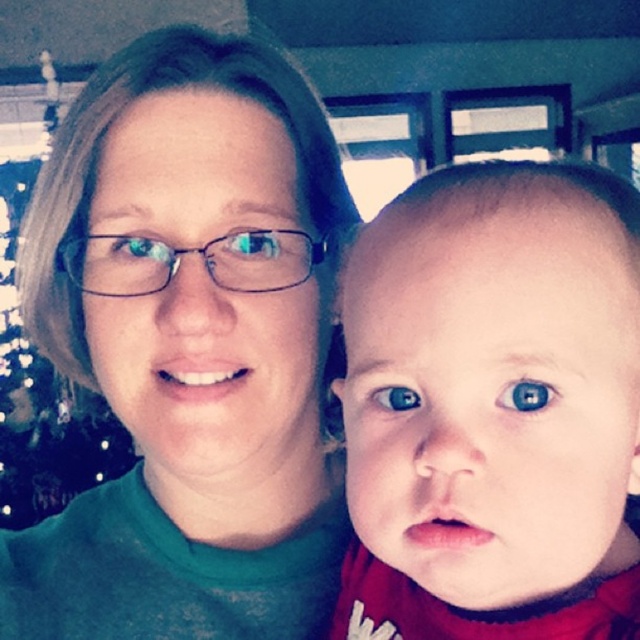
In the image described, there is a woman wearing a green top and a baby wearing a red garment. The scene also includes a Christmas tree in the background. A point labeled as point (188, 348) is noted. What object is located at this specific coordinate in the image?

The point (188, 348) marks the green matte shirt at center.

In the scene described, the woman in the green matte shirt at center and the smooth skin baby at center are positioned in a festive indoor setting with a Christmas tree in the background. Which object is located to the left of the other?

The green matte shirt at center is to the left of the smooth skin baby at center.

You are holding a small toy that is 12 inches long. You want to place it on the point at coordinates point (221, 232) so that it can be seen clearly by someone sitting directly in front of the image. Will the toy fit in front of that point without overlapping other objects?

The distance of point (221, 232) from viewer is 17.14 inches. Since the toy is 12 inches long, it will fit in front of the point as the distance available is greater than the toy length.